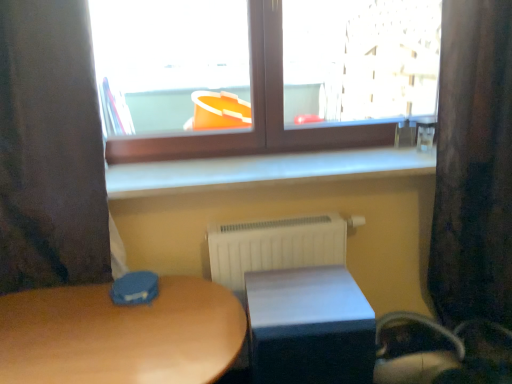
Where is `vacant space underneath dark fabric curtain at left, placed as the 1th curtain when sorted from left to right (from a real-world perspective)`? vacant space underneath dark fabric curtain at left, placed as the 1th curtain when sorted from left to right (from a real-world perspective) is located at coordinates (53, 296).